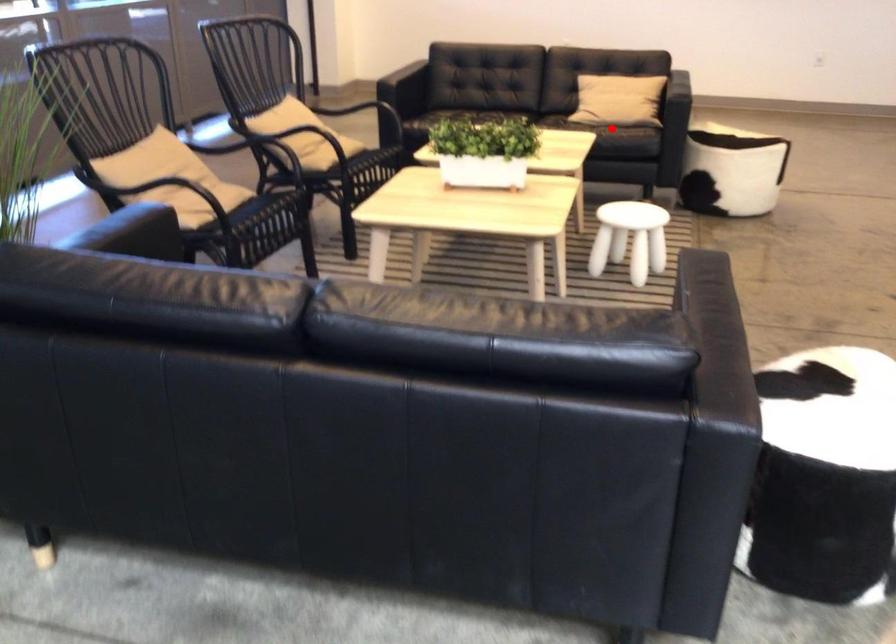
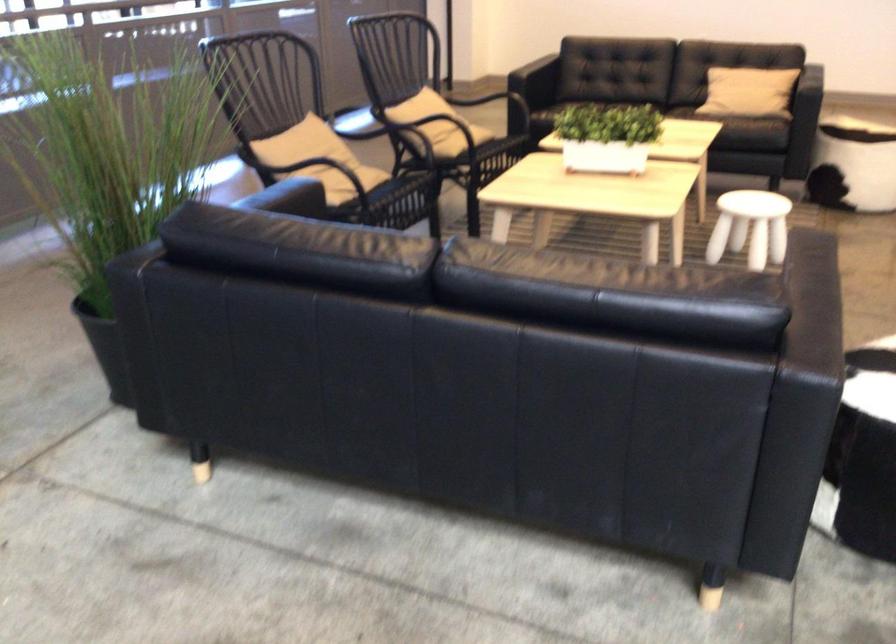
In the second image, find the point that corresponds to the highlighted location in the first image.

(745, 120)